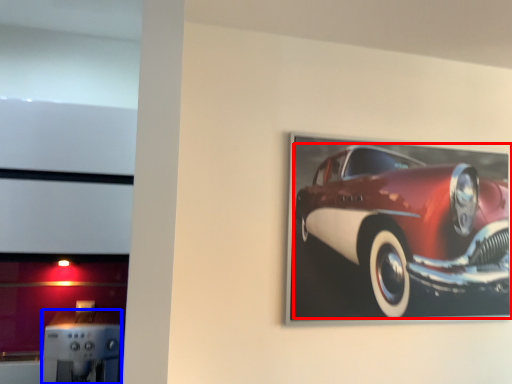
Question: Which of the following is the farthest to the observer, car (highlighted by a red box) or appliance (highlighted by a blue box)?

Choices:
 (A) car
 (B) appliance

Answer: (A)